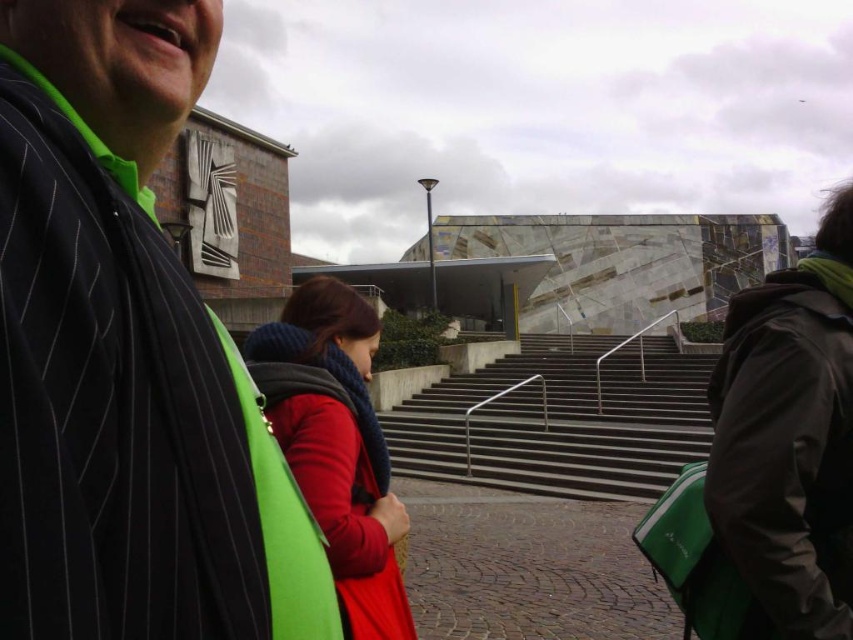
Question: Which point is farther to the camera?

Choices:
 (A) (596, 417)
 (B) (798, 484)
 (C) (59, 252)
 (D) (325, 280)

Answer: (A)

Question: Does striped fabric jacket at upper left appear under dark gray matte jacket at right?

Choices:
 (A) yes
 (B) no

Answer: (B)

Question: Among these points, which one is nearest to the camera?

Choices:
 (A) (751, 356)
 (B) (357, 499)
 (C) (229, 506)

Answer: (C)

Question: Among these objects, which one is farthest from the camera?

Choices:
 (A) striped fabric jacket at upper left
 (B) red wool scarf at center

Answer: (B)

Question: Can you confirm if dark gray matte jacket at right is positioned below slate gray concrete stairs at center?

Choices:
 (A) yes
 (B) no

Answer: (B)

Question: Can you confirm if striped fabric jacket at upper left is positioned to the right of slate gray concrete stairs at center?

Choices:
 (A) no
 (B) yes

Answer: (A)